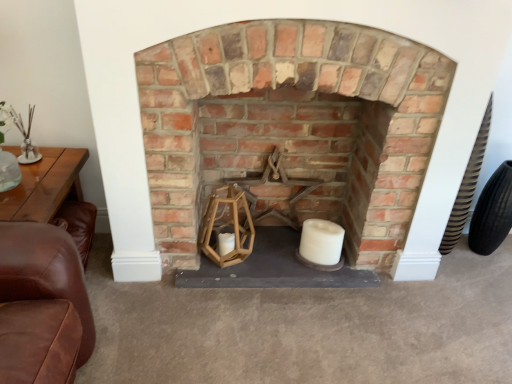
This screenshot has width=512, height=384. Find the location of `free space underneath black rubber tire at right (from a real-world perspective)`. free space underneath black rubber tire at right (from a real-world perspective) is located at coordinates (481, 255).